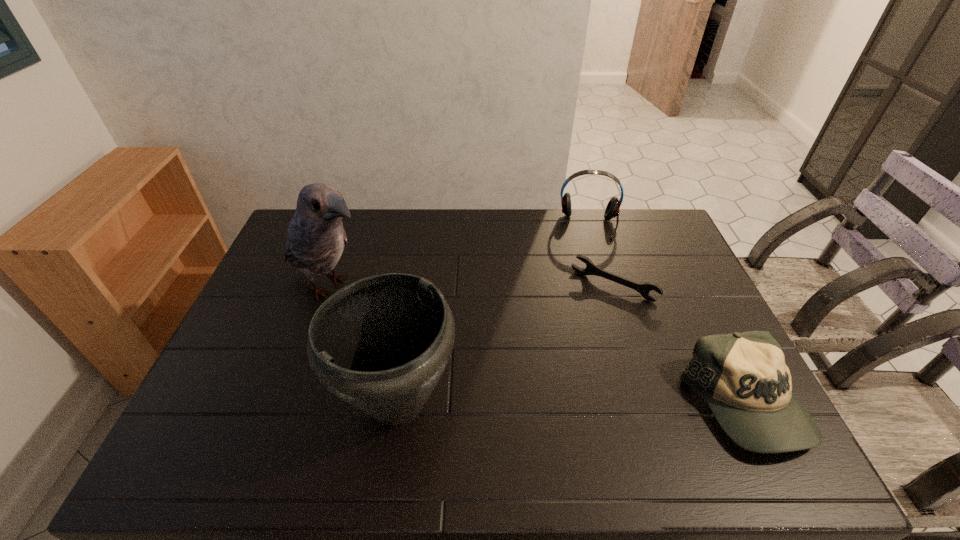
The image size is (960, 540). Identify the location of free space between the third shortest object and the parrot. tap(460, 255).

The image size is (960, 540). In order to click on blank region between the second shortest object and the headset in this screenshot , I will do `click(666, 315)`.

Where is `vacant area that lies between the baseball cap and the second tallest object`? The height and width of the screenshot is (540, 960). vacant area that lies between the baseball cap and the second tallest object is located at coordinates (571, 404).

Where is `vacant point located between the third shortest object and the shortest object`? This screenshot has height=540, width=960. vacant point located between the third shortest object and the shortest object is located at coordinates (601, 255).

Locate an element on the screen. Image resolution: width=960 pixels, height=540 pixels. unoccupied area between the baseball cap and the wrench is located at coordinates (679, 346).

You are a GUI agent. You are given a task and a screenshot of the screen. Output one action in this format:
    pyautogui.click(x=<x>, y=<y>)
    Task: Click on the closest object relative to the baseball cap
    
    Given the screenshot: What is the action you would take?
    pyautogui.click(x=591, y=269)

Where is `object that stands as the third closest to the shortest object`? The image size is (960, 540). object that stands as the third closest to the shortest object is located at coordinates (381, 344).